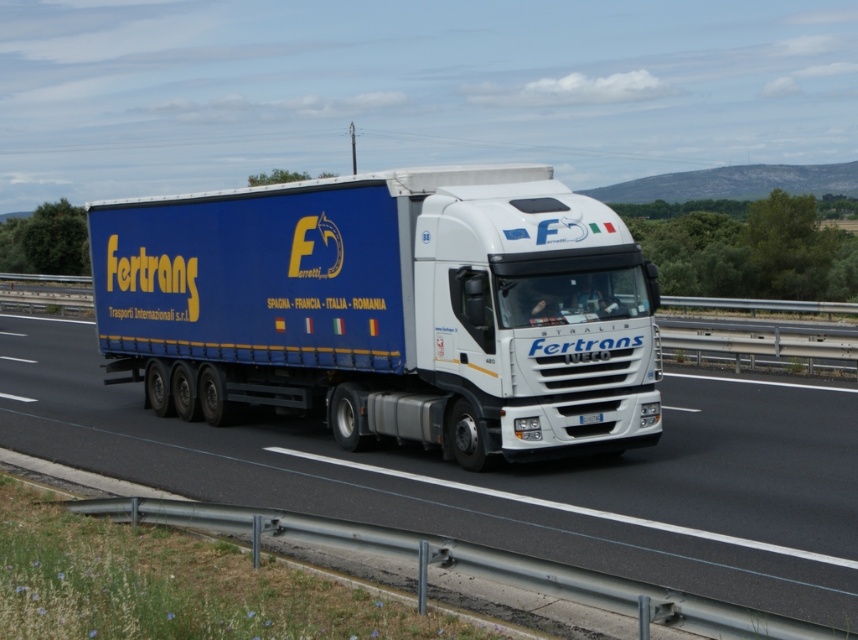
Based on the photo, you are a delivery driver who needs to park the blue matte trailer truck at center at the point marked by coordinates (390, 308). Can you confirm if the truck is already positioned correctly at that point?

The blue matte trailer truck at center is located at point (390, 308), so yes, the truck is already positioned correctly at that point.

You are a traffic officer observing a large truck on a highway. You notice the blue matte trailer truck at center and the white glossy truck at center. Which part of the truck is higher up in the image?

The blue matte trailer truck at center is located above the white glossy truck at center in the image.

You are a photographer trying to capture the Fertrans truck from the highway. You notice the blue matte trailer truck at center and the white glossy truck at center. Which one appears narrower in your photo?

The blue matte trailer truck at center is thinner than the white glossy truck at center, so it will appear narrower in the photo.